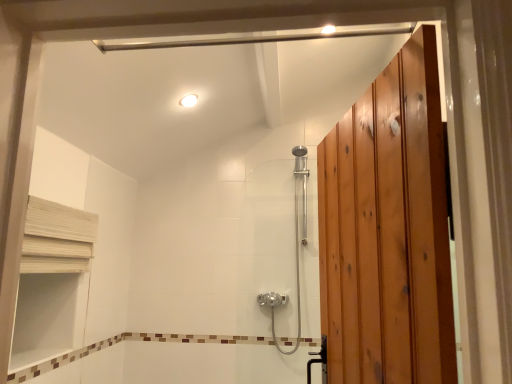
Measure the distance between point [80,255] and camera.

A distance of 2.08 meters exists between point [80,255] and camera.

You are a GUI agent. You are given a task and a screenshot of the screen. Output one action in this format:
    pyautogui.click(x=<x>, y=<y>)
    Task: Click on the polished chrome shower door at center
    
    Given the screenshot: What is the action you would take?
    pyautogui.click(x=295, y=244)

This screenshot has width=512, height=384. I want to click on white wood shelf at upper left, so click(x=57, y=238).

From a real-world perspective, which object rests below the other?

white wood shelf at upper left is physically lower.

Is white wood shelf at upper left not within white glossy light fixture at upper center?

Absolutely, white wood shelf at upper left is external to white glossy light fixture at upper center.

Is white wood shelf at upper left positioned far away from white glossy light fixture at upper center?

They are positioned close to each other.

From their relative heights in the image, would you say white wood shelf at upper left is taller or shorter than white glossy light fixture at upper center?

Considering their sizes, white wood shelf at upper left has more height than white glossy light fixture at upper center.

Which is behind, white wood shelf at upper left or polished chrome shower door at center?

polished chrome shower door at center is further from the camera.

Between white wood shelf at upper left and polished chrome shower door at center, which one appears on the left side from the viewer's perspective?

Answer: white wood shelf at upper left is more to the left.

Are white wood shelf at upper left and polished chrome shower door at center located far from each other?

white wood shelf at upper left is far away from polished chrome shower door at center.

Does point (26, 215) lie in front of point (306, 163)?

Yes, point (26, 215) is in front of point (306, 163).

Which of these two, white glossy light fixture at upper center or white wood shelf at upper left, is thinner?

white wood shelf at upper left.

Does point (182, 104) come farther from viewer compared to point (68, 240)?

Yes, it is.

Is white glossy light fixture at upper center surrounding white wood shelf at upper left?

Definitely not — white wood shelf at upper left is not inside white glossy light fixture at upper center.

Locate an element on the screen. The height and width of the screenshot is (384, 512). shelf below the white glossy light fixture at upper center (from the image's perspective) is located at coordinates (57, 238).

Which of these two, polished chrome shower door at center or white wood shelf at upper left, is smaller?

white wood shelf at upper left is smaller.

From a real-world perspective, which object stands above the other?

white wood shelf at upper left is physically above.

Is polished chrome shower door at center turned away from white wood shelf at upper left?

No, polished chrome shower door at center is not facing the opposite direction of white wood shelf at upper left.

Is polished chrome shower door at center far away from white wood shelf at upper left?

That's right, there is a large distance between polished chrome shower door at center and white wood shelf at upper left.

Is polished chrome shower door at center looking in the opposite direction of white glossy light fixture at upper center?

polished chrome shower door at center is not turned away from white glossy light fixture at upper center.

Considering the relative sizes of polished chrome shower door at center and white glossy light fixture at upper center in the image provided, is polished chrome shower door at center shorter than white glossy light fixture at upper center?

No, polished chrome shower door at center is not shorter than white glossy light fixture at upper center.

From a real-world perspective, which object rests below the other?

From a 3D spatial view, polished chrome shower door at center is below.

Does white glossy light fixture at upper center lie behind polished chrome shower door at center?

That is False.

Looking at their sizes, would you say white glossy light fixture at upper center is wider or thinner than polished chrome shower door at center?

Considering their sizes, white glossy light fixture at upper center looks slimmer than polished chrome shower door at center.

Where is `light fixture on the left of polished chrome shower door at center`? The image size is (512, 384). light fixture on the left of polished chrome shower door at center is located at coordinates (189, 100).

At what (x,y) coordinates should I click in order to perform the action: click on light fixture on the right of white wood shelf at upper left. Please return your answer as a coordinate pair (x, y). Looking at the image, I should click on (189, 100).

The image size is (512, 384). Identify the location of shelf in front of the polished chrome shower door at center. (57, 238).

When comparing their distances from white wood shelf at upper left, does white glossy light fixture at upper center or polished chrome shower door at center seem closer?

Based on the image, white glossy light fixture at upper center appears to be nearer to white wood shelf at upper left.

Looking at this image, when comparing their distances from polished chrome shower door at center, does white wood shelf at upper left or white glossy light fixture at upper center seem further?

white wood shelf at upper left is further to polished chrome shower door at center.

From the picture: Which object lies further to the anchor point white wood shelf at upper left, polished chrome shower door at center or white glossy light fixture at upper center?

polished chrome shower door at center is positioned further to the anchor white wood shelf at upper left.

Looking at the image, which one is located further to polished chrome shower door at center, white glossy light fixture at upper center or white wood shelf at upper left?

Among the two, white wood shelf at upper left is located further to polished chrome shower door at center.

From the image, which object appears to be farther from white glossy light fixture at upper center, white wood shelf at upper left or polished chrome shower door at center?

The object further to white glossy light fixture at upper center is polished chrome shower door at center.

Which object lies further to the anchor point white glossy light fixture at upper center, polished chrome shower door at center or white wood shelf at upper left?

The object further to white glossy light fixture at upper center is polished chrome shower door at center.

Locate an element on the screen. light fixture between white wood shelf at upper left and polished chrome shower door at center is located at coordinates (189, 100).